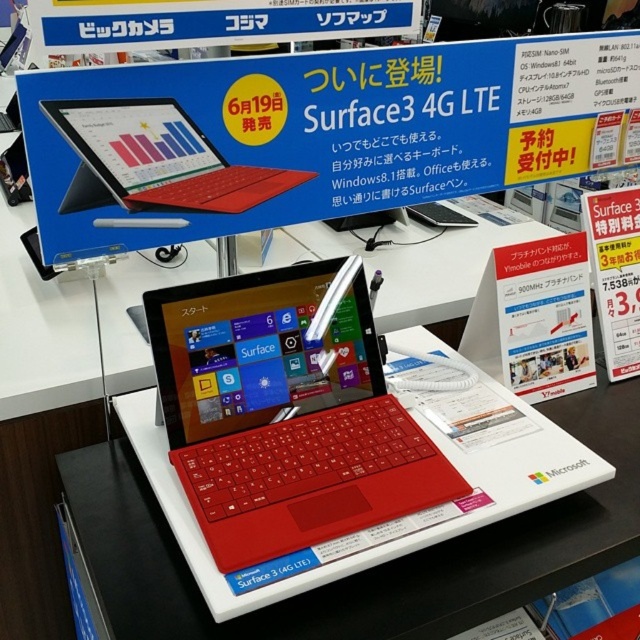
Based on the photo, what object is located at the coordinates point (316, 134) in the image?

The point (316, 134) indicates the location of the blue glossy poster at upper center.

Consider the image. You are a customer looking at the Microsoft Surface 3 display. You see the blue glossy poster at upper center and the matte red laptop at upper center. Which object is positioned to the right of the other?

The blue glossy poster at upper center is to the right of the matte red laptop at upper center.

Based on the photo, you are a customer standing in front of the retail display. You want to know if you can comfortably read the blue glossy poster at upper center while looking at the matte red laptop at center. Can you do this without moving your head?

The distance between the blue glossy poster at upper center and the matte red laptop at center is 11.04 inches, which is a short distance. Since the poster is only about a foot away from the laptop, you can comfortably read the poster without moving your head while looking at the matte red laptop at center.